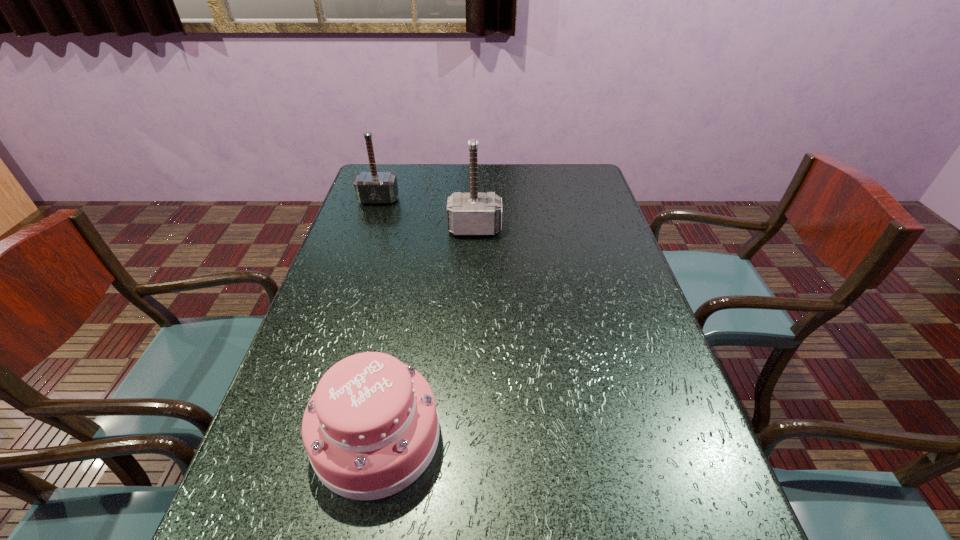
The image size is (960, 540). What are the coordinates of `free space between the left hammer and the nearer hammer` in the screenshot? It's located at (426, 214).

Locate an element on the screen. free point between the nearest object and the second farthest object is located at coordinates (426, 333).

This screenshot has width=960, height=540. In order to click on vacant point located between the cake and the right hammer in this screenshot , I will do `click(426, 333)`.

Find the location of a particular element. Image resolution: width=960 pixels, height=540 pixels. vacant space that's between the farthest object and the nearer hammer is located at coordinates point(426,214).

Identify the location of free space between the taller hammer and the nearest object. (426, 333).

In order to click on unoccupied area between the cake and the taller hammer in this screenshot , I will do `click(426, 333)`.

Point out which object is positioned as the nearest to the taller hammer. Please provide its 2D coordinates. Your answer should be formatted as a tuple, i.e. [(x, y)], where the tuple contains the x and y coordinates of a point satisfying the conditions above.

[(373, 187)]

I want to click on object that is the second closest one to the tallest object, so click(x=371, y=428).